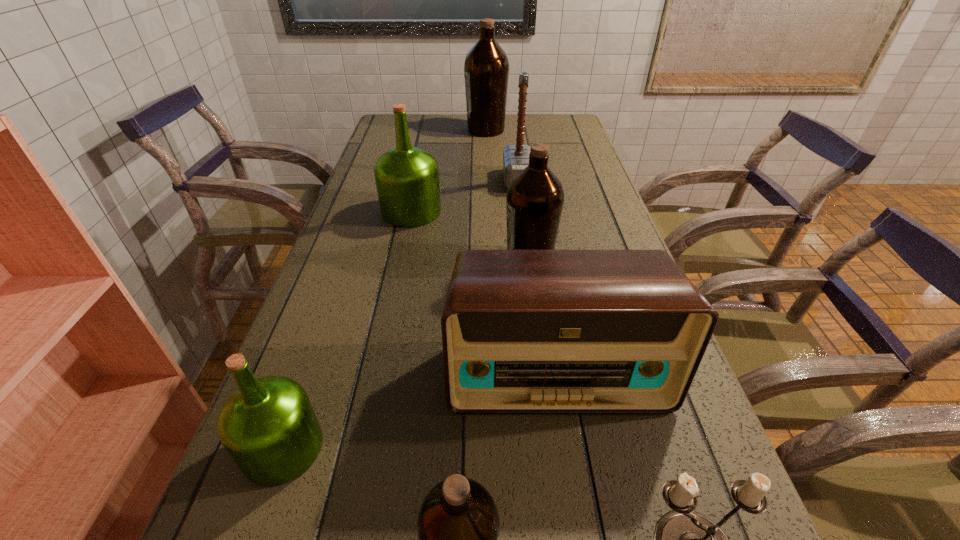
Where is `free spot that satisfies the following two spatial constraints: 1. on the label of the tallest olive oil; 2. on the front side of the nearer green olive oil`? This screenshot has height=540, width=960. free spot that satisfies the following two spatial constraints: 1. on the label of the tallest olive oil; 2. on the front side of the nearer green olive oil is located at coordinates (494, 448).